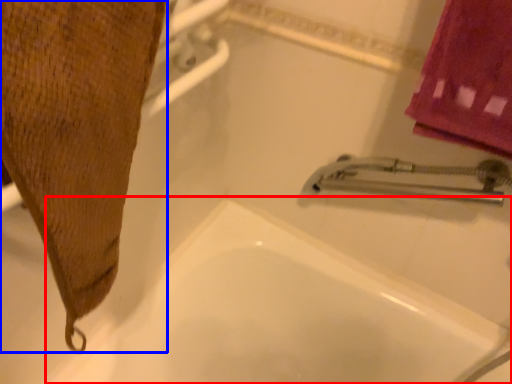
Question: Which object appears farthest to the camera in this image, bath (highlighted by a red box) or bath towel (highlighted by a blue box)?

Choices:
 (A) bath
 (B) bath towel

Answer: (A)